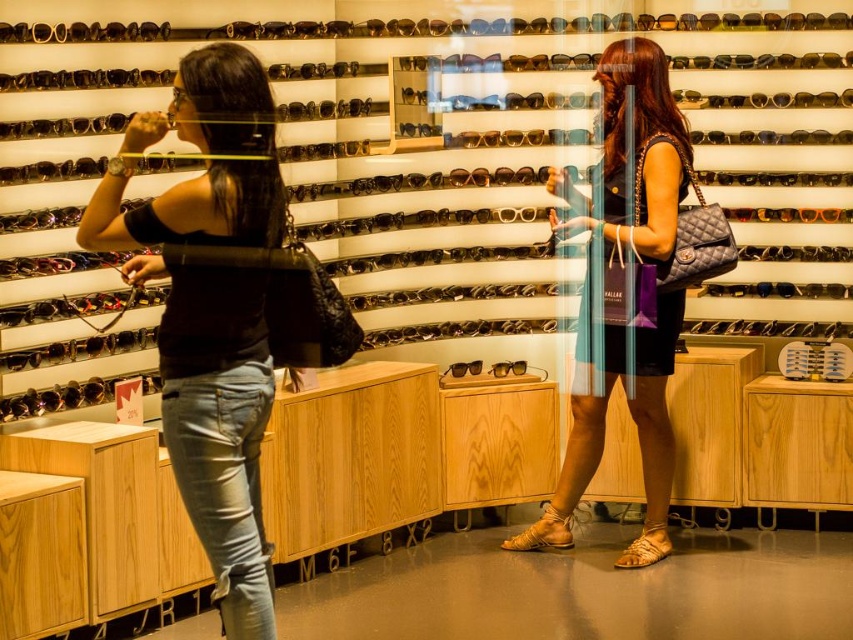
Is matte black top at left smaller than matte black dress at center?

Indeed, matte black top at left has a smaller size compared to matte black dress at center.

Does matte black top at left have a lesser width compared to matte black dress at center?

Yes.

Does point (166, 204) come farther from viewer compared to point (639, 99)?

That is False.

You are a GUI agent. You are given a task and a screenshot of the screen. Output one action in this format:
    pyautogui.click(x=<x>, y=<y>)
    Task: Click on the matte black top at left
    
    Given the screenshot: What is the action you would take?
    tap(218, 426)